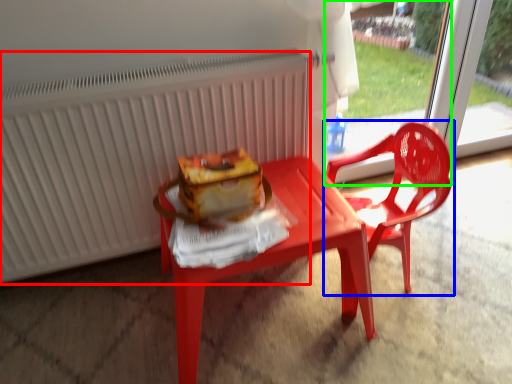
Question: Which object is positioned farthest from radiator (highlighted by a red box)? Select from chair (highlighted by a blue box) and screen door (highlighted by a green box).

Choices:
 (A) chair
 (B) screen door

Answer: (B)